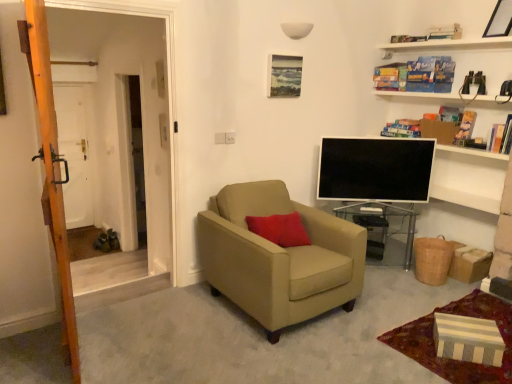
The width and height of the screenshot is (512, 384). What do you see at coordinates (465, 127) in the screenshot?
I see `hardcover book at upper right, acting as the 2th book starting from the bottom` at bounding box center [465, 127].

The image size is (512, 384). In order to click on hardcover book at upper right, which is the 4th book in top-to-bottom order in this screenshot , I will do `click(465, 127)`.

Where is `wooden picture frame at upper right, marked as the 1th picture frame in a right-to-left arrangement`? The height and width of the screenshot is (384, 512). wooden picture frame at upper right, marked as the 1th picture frame in a right-to-left arrangement is located at coordinates (500, 20).

This screenshot has height=384, width=512. Identify the location of matte wooden picture frame at upper center, the 1th picture frame when ordered from bottom to top. (285, 76).

In order to face matte wooden picture frame at upper center, the 2th picture frame in the top-to-bottom sequence, should I rotate leftwards or rightwards?

You should look right and rotate roughly 3.910 degrees.

The width and height of the screenshot is (512, 384). What are the coordinates of `hardcover book at upper right, which is the second book in top-to-bottom order` in the screenshot? It's located at (417, 75).

Image resolution: width=512 pixels, height=384 pixels. I want to click on hardcover book at upper right, the first book from the bottom, so click(x=501, y=137).

Who is more distant, hardcover book at upper right, acting as the 2th book starting from the bottom, or white matte door at left?

white matte door at left.

Does hardcover book at upper right, which is the 4th book in top-to-bottom order, have a greater width compared to white matte door at left?

Correct, the width of hardcover book at upper right, which is the 4th book in top-to-bottom order, exceeds that of white matte door at left.

Is hardcover book at upper right, which is the 4th book in top-to-bottom order, looking in the opposite direction of white matte door at left?

hardcover book at upper right, which is the 4th book in top-to-bottom order, does not have its back to white matte door at left.

Based on the photo, from a real-world perspective, who is located lower, hardcover book at upper right, which is the 4th book in top-to-bottom order, or white matte door at left?

white matte door at left is physically lower.

Is hardcover book at upper right, acting as the 2th book starting from the bottom, not inside wooden picture frame at upper right, acting as the 1th picture frame starting from the top?

Indeed, hardcover book at upper right, acting as the 2th book starting from the bottom, is completely outside wooden picture frame at upper right, acting as the 1th picture frame starting from the top.

Consider the image. In terms of size, does hardcover book at upper right, which is the 4th book in top-to-bottom order, appear bigger or smaller than wooden picture frame at upper right, the 2th picture frame viewed from the left?

In the image, hardcover book at upper right, which is the 4th book in top-to-bottom order, appears to be smaller than wooden picture frame at upper right, the 2th picture frame viewed from the left.

Consider the image. Is wooden picture frame at upper right, acting as the 1th picture frame starting from the top, at the back of hardcover book at upper right, acting as the 2th book starting from the bottom?

hardcover book at upper right, acting as the 2th book starting from the bottom, does not have its back to wooden picture frame at upper right, acting as the 1th picture frame starting from the top.

Does hardcover book at upper right, acting as the 2th book starting from the bottom, appear on the left side of beige fabric armchair at center?

No, hardcover book at upper right, acting as the 2th book starting from the bottom, is not to the left of beige fabric armchair at center.

Which is behind, hardcover book at upper right, which is the 4th book in top-to-bottom order, or beige fabric armchair at center?

hardcover book at upper right, which is the 4th book in top-to-bottom order.

Which book is the 4th one when counting from the right side of the beige fabric armchair at center? Please provide its 2D coordinates.

[(465, 127)]

Is hardcover book at upper right, which is the 4th book in top-to-bottom order, with beige fabric armchair at center?

No, hardcover book at upper right, which is the 4th book in top-to-bottom order, is not beside beige fabric armchair at center.

Considering the sizes of hardcover book at upper right, which is the 4th book in top-to-bottom order, and transparent glass table at center in the image, is hardcover book at upper right, which is the 4th book in top-to-bottom order, wider or thinner than transparent glass table at center?

hardcover book at upper right, which is the 4th book in top-to-bottom order, is thinner than transparent glass table at center.

Who is bigger, hardcover book at upper right, acting as the 2th book starting from the bottom, or transparent glass table at center?

Bigger between the two is transparent glass table at center.

Is hardcover book at upper right, acting as the 2th book starting from the bottom, facing away from transparent glass table at center?

No, transparent glass table at center is not at the back of hardcover book at upper right, acting as the 2th book starting from the bottom.

Can you tell me how much hardcover book at upper right, acting as the 2th book starting from the bottom, and transparent glass table at center differ in facing direction?

The angle between the facing direction of hardcover book at upper right, acting as the 2th book starting from the bottom, and the facing direction of transparent glass table at center is 53.2 degrees.

Is white matte door at left to the right of hardcover book at upper right, which is the fifth book in top-to-bottom order, from the viewer's perspective?

No, white matte door at left is not to the right of hardcover book at upper right, which is the fifth book in top-to-bottom order.

Can hardcover book at upper right, which is the fifth book in top-to-bottom order, be found inside white matte door at left?

No, white matte door at left does not contain hardcover book at upper right, which is the fifth book in top-to-bottom order.

From the image's perspective, between white matte door at left and hardcover book at upper right, the first book from the bottom, which one is located above?

From the image's view, hardcover book at upper right, the first book from the bottom, is above.

Is wooden picture frame at upper right, acting as the second picture frame starting from the back, positioned with its back to hardcover book at upper right, the fourth book in the bottom-to-top sequence?

wooden picture frame at upper right, acting as the second picture frame starting from the back, is not turned away from hardcover book at upper right, the fourth book in the bottom-to-top sequence.

Is wooden picture frame at upper right, the 2th picture frame viewed from the left, beside hardcover book at upper right, the fourth book in the bottom-to-top sequence?

wooden picture frame at upper right, the 2th picture frame viewed from the left, and hardcover book at upper right, the fourth book in the bottom-to-top sequence, are not in contact.

How many degrees apart are the facing directions of wooden picture frame at upper right, which is the first picture frame from front to back, and hardcover book at upper right, which is the second book in top-to-bottom order?

wooden picture frame at upper right, which is the first picture frame from front to back, and hardcover book at upper right, which is the second book in top-to-bottom order, are facing 23.5 degrees away from each other.

Is wooden picture frame at upper right, which is the first picture frame from front to back, taller or shorter than hardcover book at upper right, the fourth book in the bottom-to-top sequence?

Considering their sizes, wooden picture frame at upper right, which is the first picture frame from front to back, has less height than hardcover book at upper right, the fourth book in the bottom-to-top sequence.

From their relative heights in the image, would you say wooden ladder at left is taller or shorter than wooden picture frame at upper right, which is the first picture frame from front to back?

In the image, wooden ladder at left appears to be taller than wooden picture frame at upper right, which is the first picture frame from front to back.

Based on the photo, can you confirm if wooden ladder at left is smaller than wooden picture frame at upper right, which is the first picture frame from front to back?

No, wooden ladder at left is not smaller than wooden picture frame at upper right, which is the first picture frame from front to back.

How different are the orientations of wooden ladder at left and wooden picture frame at upper right, acting as the 1th picture frame starting from the top, in degrees?

168 degrees separate the facing orientations of wooden ladder at left and wooden picture frame at upper right, acting as the 1th picture frame starting from the top.

The width and height of the screenshot is (512, 384). What are the coordinates of `ladder that appears below the wooden picture frame at upper right, which is the first picture frame from front to back (from a real-world perspective)` in the screenshot? It's located at (51, 166).

Locate an element on the screen. book that is the 2nd one above the white matte door at left (from a real-world perspective) is located at coordinates (465, 127).

From the image's perspective, count 3rd books downward from the wooden picture frame at upper right, the 2th picture frame viewed from the left, and point to it. Please provide its 2D coordinates.

[(465, 127)]

Considering their positions, is transparent glass table at center positioned closer to hardcover book at upper right, the first book from the bottom, than white matte door at left?

transparent glass table at center lies closer to hardcover book at upper right, the first book from the bottom, than the other object.

From the picture: From the image, which object appears to be farther from white glossy tv at center, hardcover book at upper right, marked as the third book in a top-to-bottom arrangement, or wooden ladder at left?

wooden ladder at left is positioned further to the anchor white glossy tv at center.

From the image, which object appears to be farther from white matte door at left, transparent glass table at center or white glossy tv at center?

transparent glass table at center is further to white matte door at left.

Considering their positions, is wooden ladder at left positioned further to hardcover book at upper right, acting as the 2th book starting from the bottom, than beige fabric armchair at center?

The object further to hardcover book at upper right, acting as the 2th book starting from the bottom, is wooden ladder at left.

Based on the photo, looking at the image, which one is located further to hardcover book at upper right, the 3th book positioned from the bottom, white matte door at left or wooden picture frame at upper right, the 2th picture frame viewed from the left?

white matte door at left is positioned further to the anchor hardcover book at upper right, the 3th book positioned from the bottom.

Looking at this image, from the image, which object appears to be farther from wooden picture frame at upper right, arranged as the second picture frame when ordered from the bottom, hardcover book at upper right, the 3th book positioned from the bottom, or transparent glass table at center?

Among the two, transparent glass table at center is located further to wooden picture frame at upper right, arranged as the second picture frame when ordered from the bottom.

Based on their spatial positions, is wooden ladder at left or matte wooden picture frame at upper center, which ranks as the second picture frame in right-to-left order, closer to beige fabric armchair at center?

wooden ladder at left.

Based on their spatial positions, is transparent glass table at center or wooden picture frame at upper right, acting as the 1th picture frame starting from the top, further from hardcover book at upper center, acting as the first book starting from the top?

transparent glass table at center is further to hardcover book at upper center, acting as the first book starting from the top.

I want to click on chair situated between white matte door at left and hardcover book at upper center, the fifth book when ordered from bottom to top, from left to right, so click(x=279, y=257).

Where is `ladder between white matte door at left and hardcover book at upper right, the fourth book in the bottom-to-top sequence, from left to right`? The height and width of the screenshot is (384, 512). ladder between white matte door at left and hardcover book at upper right, the fourth book in the bottom-to-top sequence, from left to right is located at coordinates (51, 166).

The height and width of the screenshot is (384, 512). Identify the location of television between hardcover book at upper right, which is the 4th book in top-to-bottom order, and transparent glass table at center vertically. (375, 169).

Identify the location of table located between wooden ladder at left and hardcover book at upper right, the fourth book in the bottom-to-top sequence, in the left-right direction. The width and height of the screenshot is (512, 384). (381, 224).